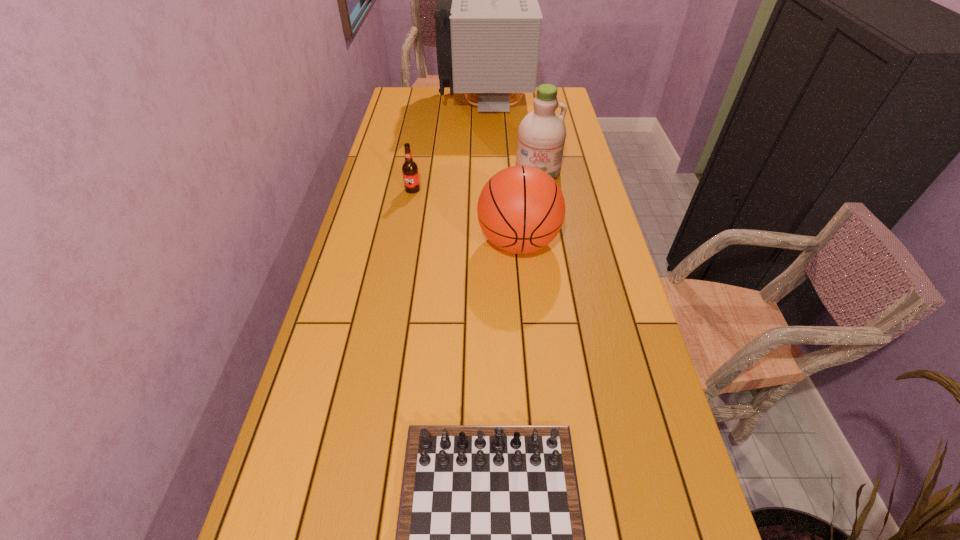
Identify the location of the tallest object. (488, 21).

Where is `fan`? fan is located at coordinates (488, 21).

Find the location of a particular element. The height and width of the screenshot is (540, 960). cleansing agent is located at coordinates (541, 135).

You are a GUI agent. You are given a task and a screenshot of the screen. Output one action in this format:
    pyautogui.click(x=<x>, y=<y>)
    Task: Click on the second farthest object
    The width and height of the screenshot is (960, 540).
    Given the screenshot: What is the action you would take?
    pyautogui.click(x=541, y=135)

Where is `the third shortest object`? the third shortest object is located at coordinates (521, 209).

Where is `the fourth farthest object`? The image size is (960, 540). the fourth farthest object is located at coordinates (521, 209).

This screenshot has height=540, width=960. In order to click on the third nearest object in this screenshot , I will do `click(410, 173)`.

Find the location of `root beer`. root beer is located at coordinates (410, 173).

Find the location of a particular element. The image size is (960, 540). vacant region located on the right of the fan is located at coordinates pos(546,105).

Where is `free space located 0.060m on the front label of the cleansing agent`? The height and width of the screenshot is (540, 960). free space located 0.060m on the front label of the cleansing agent is located at coordinates (541, 194).